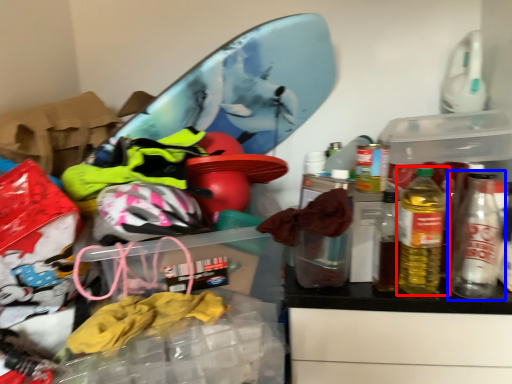
Question: Which of the following is the closest to the observer, bottle (highlighted by a red box) or bottle (highlighted by a blue box)?

Choices:
 (A) bottle
 (B) bottle

Answer: (A)